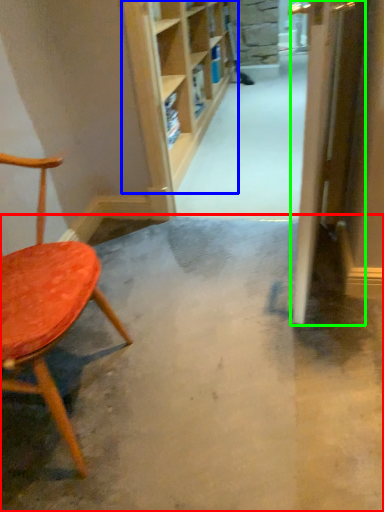
Question: Which object is positioned closest to concrete (highlighted by a red box)? Select from shelf (highlighted by a blue box) and door (highlighted by a green box).

Choices:
 (A) shelf
 (B) door

Answer: (B)